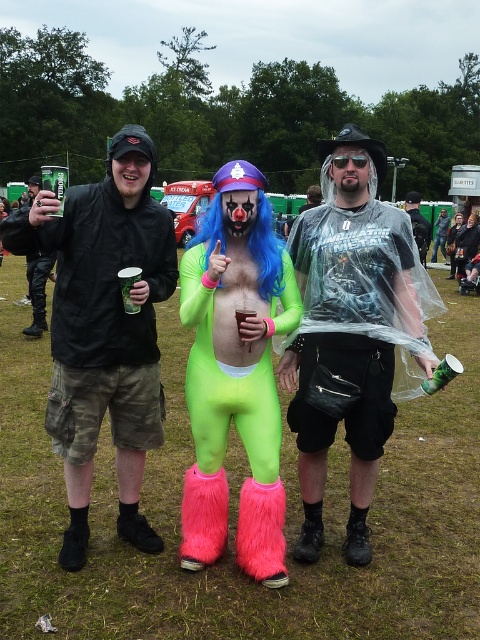
What is located at the coordinate point (104, 328) in the image?

The black matte jacket at left is located at the coordinate point (104, 328).

You are at the festival and want to hand a flyer to the person holding the green plastic cup at center. Which direction should you walk from the black matte jacket at left to reach them?

The green plastic cup at center is to the right of the black matte jacket at left, so you should walk to the right to reach the person holding the green plastic cup at center.

You are standing at point A located at coordinates point (141, 272) and you want to walk to point B located at coordinates point (156, 346). Which direction should you move to reach point B from point A?

To reach point B located at coordinates point (156, 346) from point A located at coordinates point (141, 272), you should move towards the right and slightly forward since point B is behind point A according to the spatial description.